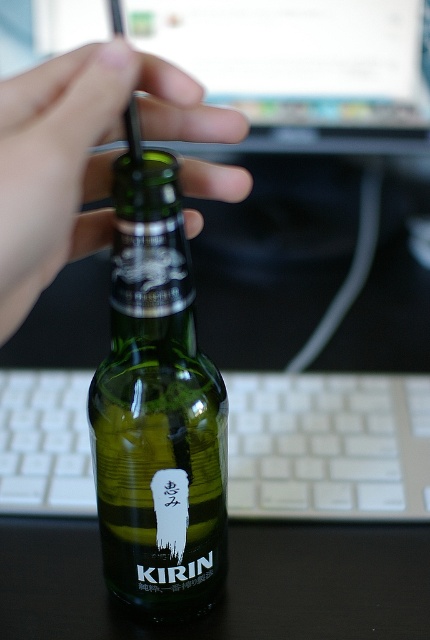
You are trying to open the green glass bottle labeled KIRIN with Japanese characters above it using a bottle opener. The bottle opener is at point (193, 580). If the bottle cap is 18.80 inches away from the bottle opener, can you reach it without moving the opener?

The bottle opener at point (193, 580) is 18.80 inches away from the bottle cap. Since the distance between them is 18.80 inches, you would need to move the opener closer to reach the bottle cap unless you have an extended tool.

You are trying to open the green glass bottle at center. If your hand is 13.07 inches away from the bottle, can you reach it without moving your arm?

The green glass bottle at center is 13.07 inches away from the viewer, so yes, you can reach it without moving your arm since the average human arm length is longer than 13.07 inches.

You are trying to open the green glass bottle at center with the green matte bottle cap at center. Which object has a smaller diameter?

The green glass bottle at center is thinner than the green matte bottle cap at center, so the green glass bottle at center has a smaller diameter.